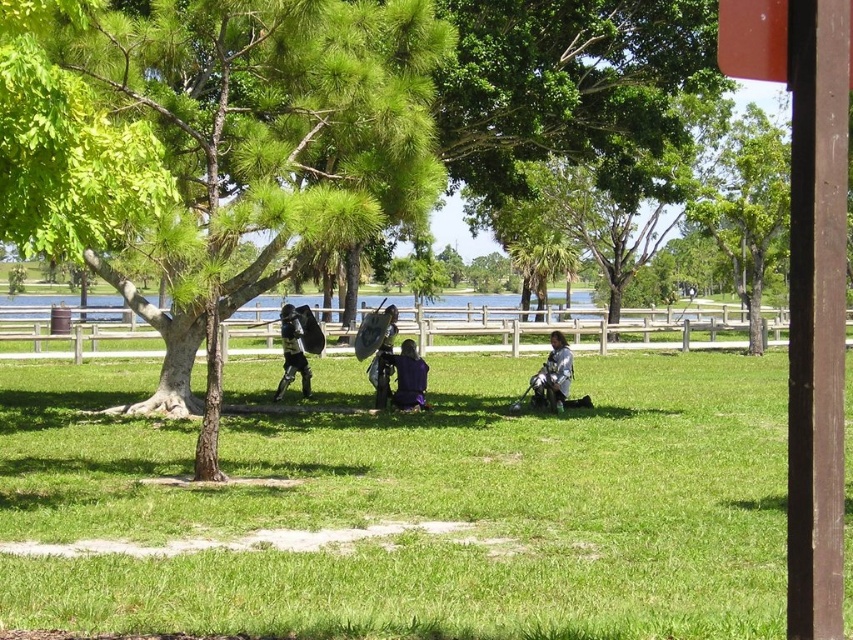
Question: From the image, what is the correct spatial relationship of green grass at center in relation to shiny silver armor at center?

Choices:
 (A) below
 (B) above

Answer: (A)

Question: Can you confirm if purple fabric backpack at center is positioned to the right of shiny silver armor at center?

Choices:
 (A) yes
 (B) no

Answer: (B)

Question: Which object is positioned farthest from the purple fabric backpack at center?

Choices:
 (A) green leafy tree at center
 (B) green grass at center
 (C) black matte armor at center

Answer: (A)

Question: Where is green grass at center located in relation to purple fabric backpack at center in the image?

Choices:
 (A) below
 (B) above

Answer: (A)

Question: Which of the following is the farthest from the observer?

Choices:
 (A) green leafy tree at center
 (B) green grass at center
 (C) purple fabric backpack at center
 (D) shiny silver armor at center

Answer: (C)

Question: Which of these objects is positioned farthest from the green grass at center?

Choices:
 (A) black matte armor at center
 (B) green leafy tree at center

Answer: (A)